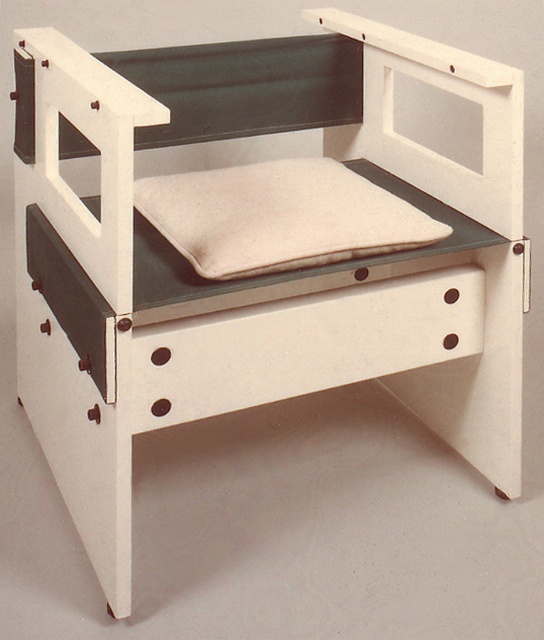
In the scene shown: Between white matte drawer at lower center and beige fabric cushion at center, which one is positioned lower?

Positioned lower is white matte drawer at lower center.

Does white matte drawer at lower center appear on the right side of beige fabric cushion at center?

Yes, white matte drawer at lower center is to the right of beige fabric cushion at center.

Between point (305, 300) and point (228, 176), which one is positioned behind?

The point (228, 176) is behind.

The image size is (544, 640). Find the location of `white matte drawer at lower center`. white matte drawer at lower center is located at coordinates (300, 346).